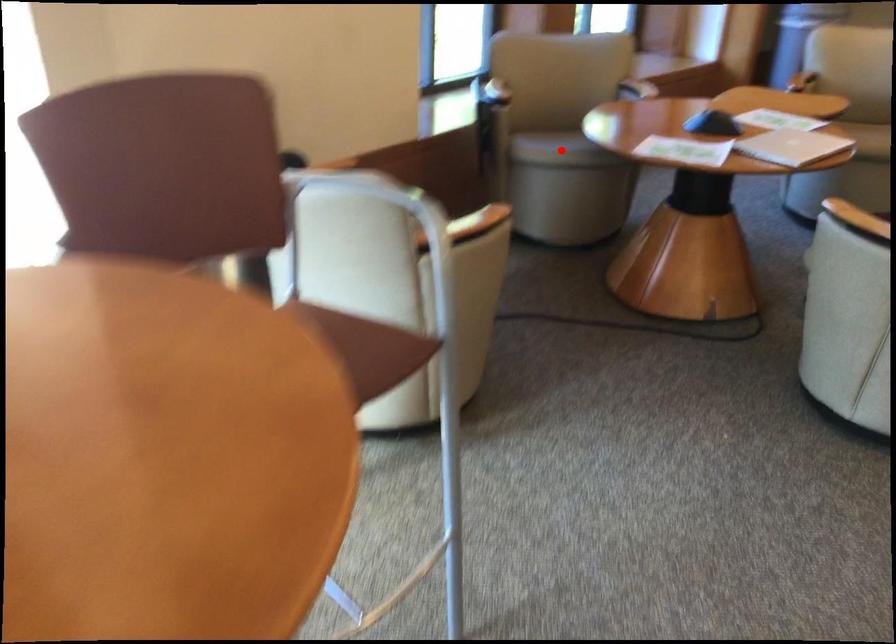
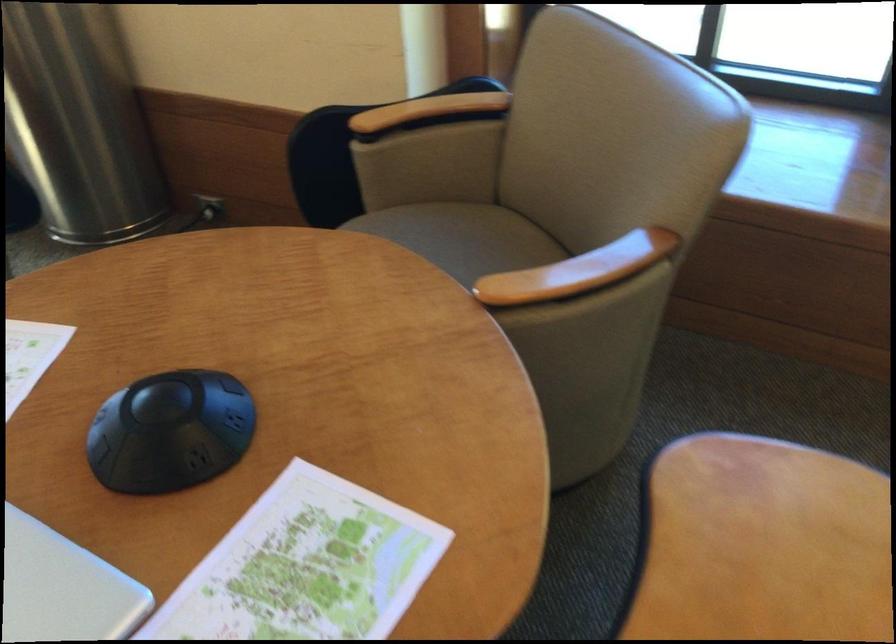
Question: I am providing you with two images of the same scene from different viewpoints. A red point is marked on the first image. Can you still see the location of the red point in image 2?

Choices:
 (A) Yes
 (B) No

Answer: (B)